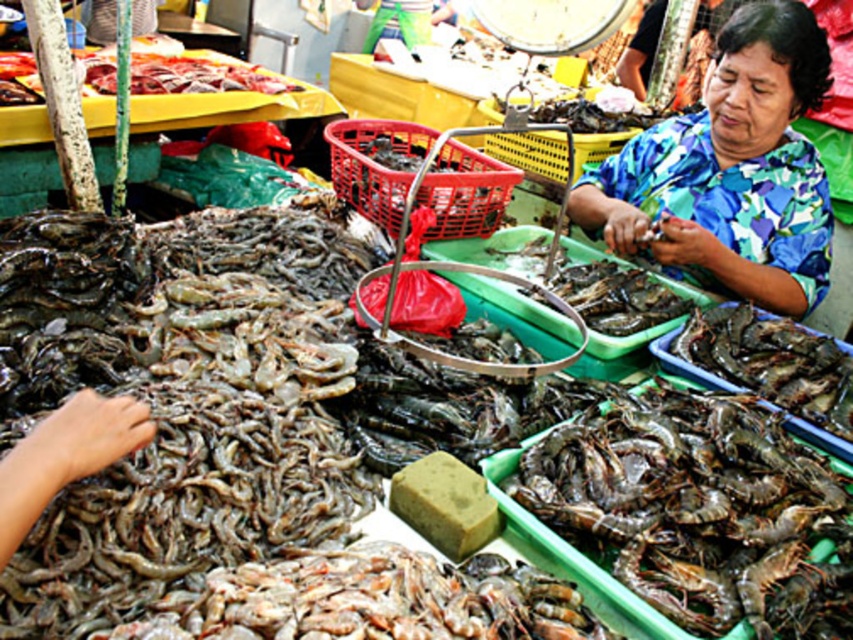
Who is positioned more to the right, gray matte shrimp at lower center or raw meat at upper left?

gray matte shrimp at lower center is more to the right.

Between point (741, 525) and point (225, 90), which one is positioned behind?

Point (225, 90)

Identify the location of gray matte shrimp at lower center. (682, 500).

Is point (822, 49) closer to camera compared to point (242, 72)?

Yes, point (822, 49) is in front of point (242, 72).

Who is positioned more to the left, blue floral shirt at upper right or raw meat at upper left?

From the viewer's perspective, raw meat at upper left appears more on the left side.

At what (x,y) coordinates should I click in order to perform the action: click on blue floral shirt at upper right. Please return your answer as a coordinate pair (x, y). Image resolution: width=853 pixels, height=640 pixels. Looking at the image, I should click on (730, 172).

You are a GUI agent. You are given a task and a screenshot of the screen. Output one action in this format:
    pyautogui.click(x=<x>, y=<y>)
    Task: Click on the blue floral shirt at upper right
    This screenshot has width=853, height=640.
    Given the screenshot: What is the action you would take?
    pyautogui.click(x=730, y=172)

Can you confirm if gray matte shrimp at lower center is taller than blue floral shirt at upper right?

In fact, gray matte shrimp at lower center may be shorter than blue floral shirt at upper right.

Is point (785, 461) farther from viewer compared to point (779, 147)?

That is False.

Is point (741, 472) positioned behind point (717, 100)?

No, (741, 472) is closer to viewer.

I want to click on gray matte shrimp at lower center, so click(x=682, y=500).